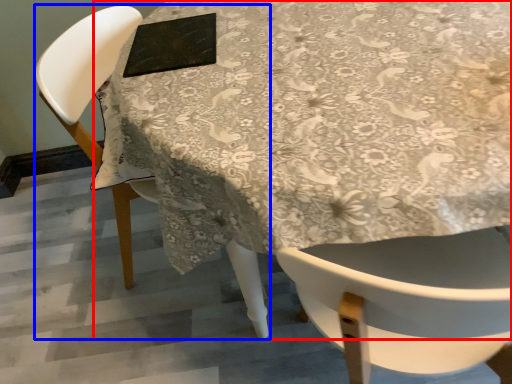
Question: Among these objects, which one is farthest to the camera, table (highlighted by a red box) or chair (highlighted by a blue box)?

Choices:
 (A) table
 (B) chair

Answer: (B)